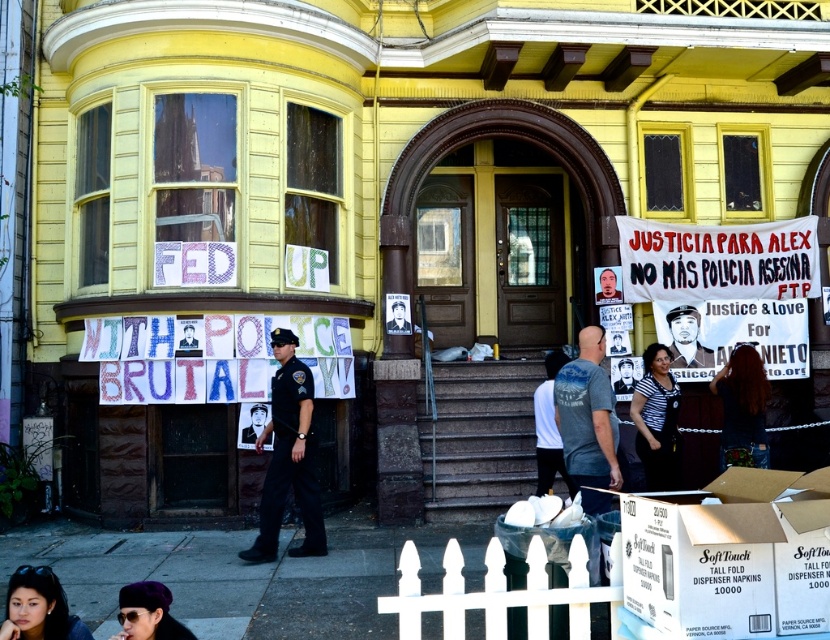
You are a photographer standing at the scene of the protest. You want to capture a closeup shot of the striped shirt at center. Given that your camera has a minimum focusing distance of 5 meters, will you be able to take the photo without moving closer?

The striped shirt at center is 9.18 meters away from the camera. Since the minimum focusing distance is 5 meters, you can take the photo without moving closer because the shirt is beyond the minimum required distance.

You are a photographer standing in front of the yellow building and want to take a photo of both the smooth skin face at lower left and the black matte photo at center. Which object should you focus on first to ensure both are in clear view?

You should focus on the smooth skin face at lower left first because it is closer to the viewer than the black matte photo at center, so adjusting focus from near to far will help both be in clear view.

You are a photographer trying to capture a clear image of both the striped shirt at center and the black matte poster at center. Since you want to focus on the smaller object, which one should you zoom in on?

The black matte poster at center is smaller than the striped shirt at center, so you should zoom in on the black matte poster at center to focus on the smaller object.